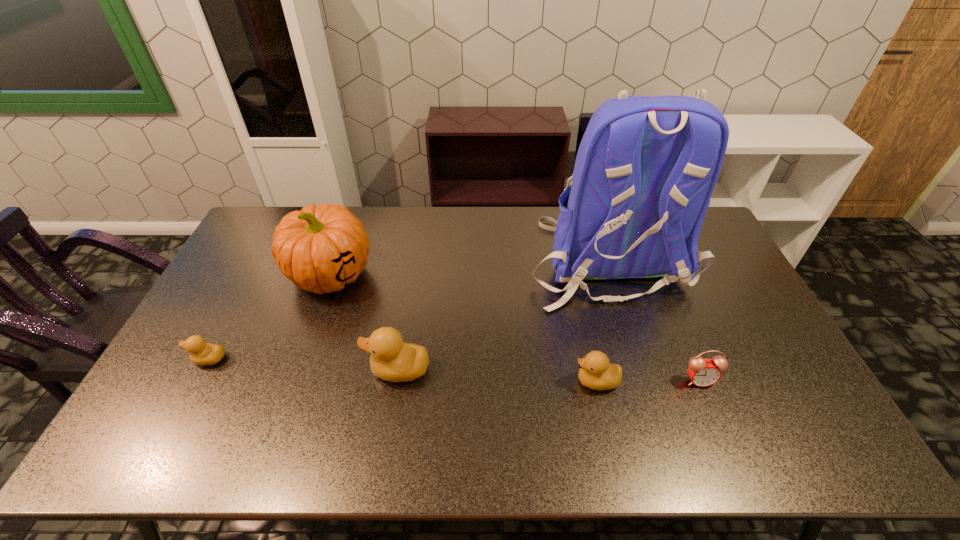
Where is `free region that satisfies the following two spatial constraints: 1. on the back of the backpack; 2. on the face of the rightmost duckling`? free region that satisfies the following two spatial constraints: 1. on the back of the backpack; 2. on the face of the rightmost duckling is located at coordinates (646, 381).

The height and width of the screenshot is (540, 960). Find the location of `vacant area that satisfies the following two spatial constraints: 1. on the back of the backpack; 2. on the face of the leftmost object`. vacant area that satisfies the following two spatial constraints: 1. on the back of the backpack; 2. on the face of the leftmost object is located at coordinates (639, 359).

Find the location of a particular element. free location that satisfies the following two spatial constraints: 1. on the surface of the fifth object from right to left; 2. on the face of the shortest object is located at coordinates (300, 359).

At what (x,y) coordinates should I click in order to perform the action: click on free space that satisfies the following two spatial constraints: 1. on the back of the tallest object; 2. on the face of the rightmost duckling. Please return your answer as a coordinate pair (x, y). Looking at the image, I should click on coord(646,381).

The height and width of the screenshot is (540, 960). Find the location of `blank area in the image that satisfies the following two spatial constraints: 1. on the surface of the second object from left to right; 2. on the face of the leftmost duckling`. blank area in the image that satisfies the following two spatial constraints: 1. on the surface of the second object from left to right; 2. on the face of the leftmost duckling is located at coordinates (300, 359).